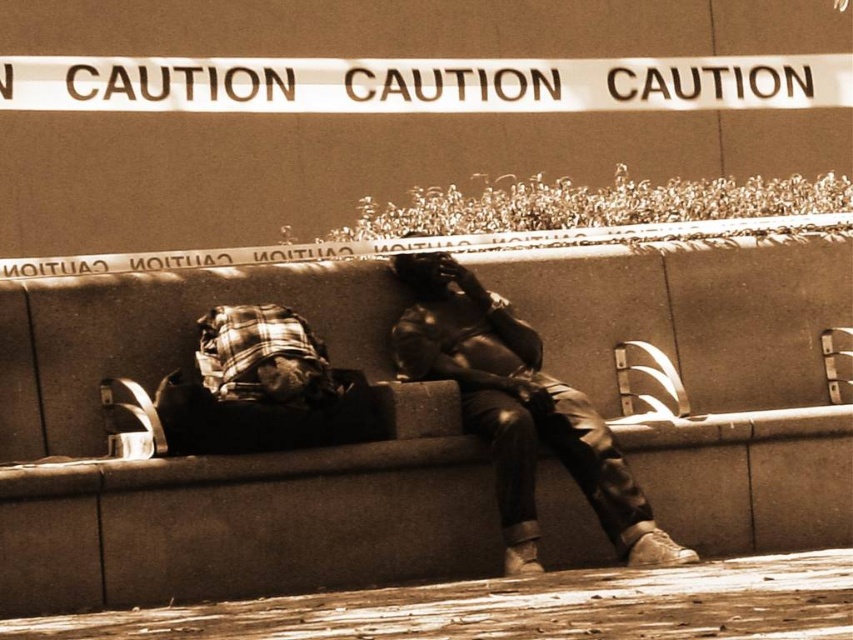
You are a passerby who wants to know what the point at coordinates [518,410] on the image represents. What object is located at that point?

The point at coordinates [518,410] corresponds to the matte black jacket at center.

You are a social worker trying to approach someone in need. You see a smooth concrete bench at center and a matte black jacket at center. How far apart are these two items from each other?

The smooth concrete bench at center is 3.55 feet away from the matte black jacket at center.

You are a photographer trying to capture the scene of the person on the bench. You notice two points in the image at coordinates point (691, 355) and point (155, 444). Which point should you focus on first if you want to ensure both points are in sharp focus?

You should focus on point (691, 355) first because it is further away from the camera than point (155, 444), ensuring the depth of field captures both points clearly.